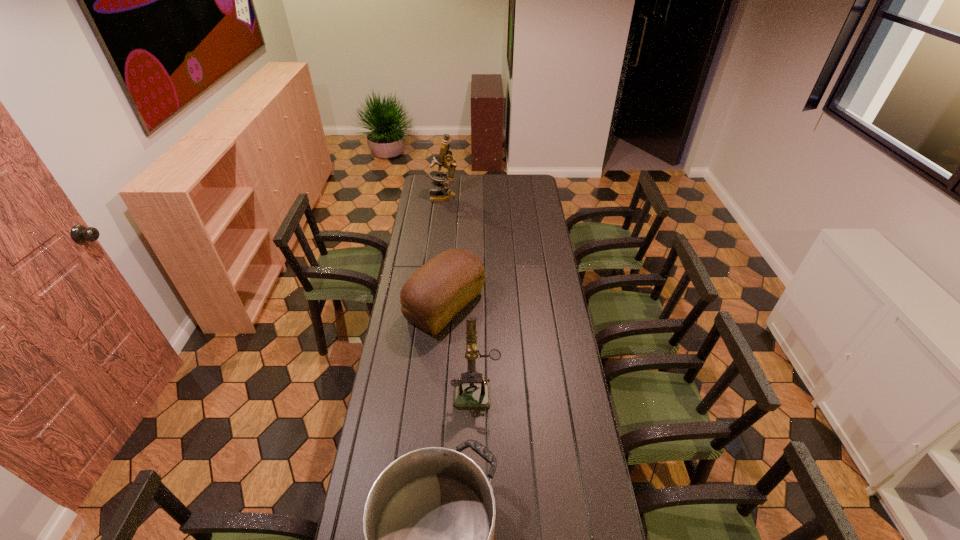
Image resolution: width=960 pixels, height=540 pixels. What are the coordinates of `object that can be found as the second closest to the taller microscope` in the screenshot? It's located at (471, 395).

Where is `vacant space that satisfies the following two spatial constraints: 1. on the front side of the left microscope; 2. on the right side of the second farthest object`? vacant space that satisfies the following two spatial constraints: 1. on the front side of the left microscope; 2. on the right side of the second farthest object is located at coordinates (431, 306).